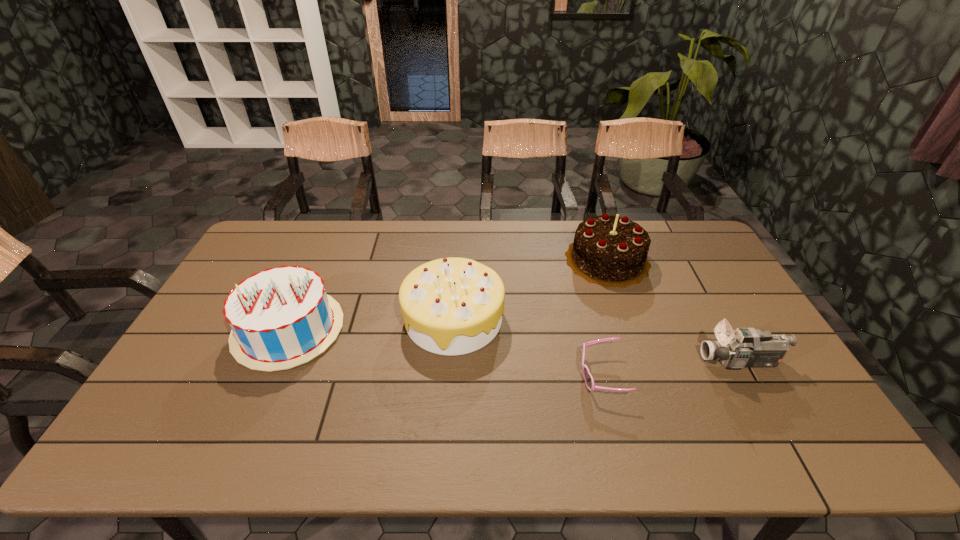
Find the location of a particular element. free space between the second object from left to right and the rightmost birthday cake is located at coordinates (530, 289).

I want to click on free spot between the camcorder and the sunglasses, so click(671, 368).

Locate an element on the screen. This screenshot has width=960, height=540. free space between the second birthday cake from left to right and the sunglasses is located at coordinates (527, 347).

Locate which object ranks second in proximity to the second birthday cake from left to right. Please provide its 2D coordinates. Your answer should be formatted as a tuple, i.e. [(x, y)], where the tuple contains the x and y coordinates of a point satisfying the conditions above.

[(588, 378)]

This screenshot has height=540, width=960. Find the location of `object that is the fourth closest to the rightmost object`. object that is the fourth closest to the rightmost object is located at coordinates (281, 317).

The height and width of the screenshot is (540, 960). Find the location of `birthday cake that stands as the closest to the camcorder`. birthday cake that stands as the closest to the camcorder is located at coordinates (608, 250).

Find the location of a particular element. The height and width of the screenshot is (540, 960). birthday cake that can be found as the second closest to the rightmost birthday cake is located at coordinates (281, 317).

Locate an element on the screen. This screenshot has width=960, height=540. free space that satisfies the following two spatial constraints: 1. on the back side of the rightmost birthday cake; 2. on the right side of the second birthday cake from left to right is located at coordinates (457, 260).